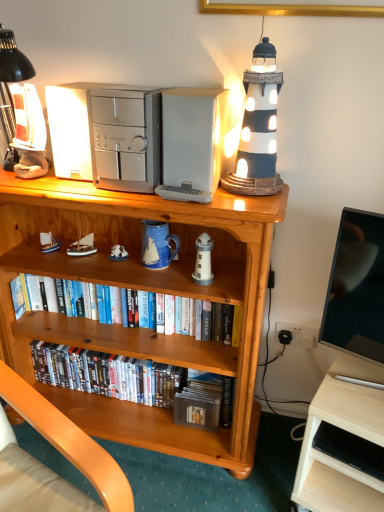
Question: From a real-world perspective, is matte black lighthouse at upper right on top of wooden bookcase at center?

Choices:
 (A) yes
 (B) no

Answer: (A)

Question: Are matte black lighthouse at upper right and wooden bookcase at center located far from each other?

Choices:
 (A) no
 (B) yes

Answer: (A)

Question: Is matte black lighthouse at upper right directly adjacent to wooden bookcase at center?

Choices:
 (A) no
 (B) yes

Answer: (A)

Question: Is matte black lighthouse at upper right shorter than wooden bookcase at center?

Choices:
 (A) yes
 (B) no

Answer: (A)

Question: Can you confirm if matte black lighthouse at upper right is thinner than wooden bookcase at center?

Choices:
 (A) no
 (B) yes

Answer: (B)

Question: From the image's perspective, is white matte lighthouse at center, arranged as the 3th toy when viewed from the back, positioned above or below white wood desk at lower right?

Choices:
 (A) below
 (B) above

Answer: (B)

Question: Would you say white matte lighthouse at center, which is counted as the 1th toy, starting from the front, is inside or outside white wood desk at lower right?

Choices:
 (A) inside
 (B) outside

Answer: (B)

Question: Considering the positions of point (206, 278) and point (354, 391), is point (206, 278) closer or farther from the camera than point (354, 391)?

Choices:
 (A) farther
 (B) closer

Answer: (A)

Question: In terms of width, does white matte lighthouse at center, marked as the first toy in a right-to-left arrangement, look wider or thinner when compared to white wood desk at lower right?

Choices:
 (A) thin
 (B) wide

Answer: (A)

Question: From the image's perspective, is hardcover books at center, which ranks as the second book in top-to-bottom order, located above or below white plastic microwave at upper center, the third appliance when ordered from left to right?

Choices:
 (A) above
 (B) below

Answer: (B)

Question: Is hardcover books at center, which ranks as the second book in top-to-bottom order, wider or thinner than white plastic microwave at upper center, the third appliance when ordered from left to right?

Choices:
 (A) thin
 (B) wide

Answer: (B)

Question: From a real-world perspective, is hardcover books at center, which is counted as the first book, starting from the bottom, positioned above or below white plastic microwave at upper center, which is the 1th appliance from right to left?

Choices:
 (A) above
 (B) below

Answer: (B)

Question: Based on their sizes in the image, would you say hardcover books at center, which is counted as the first book, starting from the bottom, is bigger or smaller than white plastic microwave at upper center, the third appliance when ordered from left to right?

Choices:
 (A) small
 (B) big

Answer: (B)

Question: From the image's perspective, relative to white ceramic figurine at center, which appears as the 2th toy when viewed from the right, is hardcover books at center, which is counted as the first book, starting from the bottom, above or below?

Choices:
 (A) above
 (B) below

Answer: (B)

Question: Is hardcover books at center, which is counted as the first book, starting from the bottom, to the left or to the right of white ceramic figurine at center, which is the third toy in front-to-back order, in the image?

Choices:
 (A) left
 (B) right

Answer: (B)